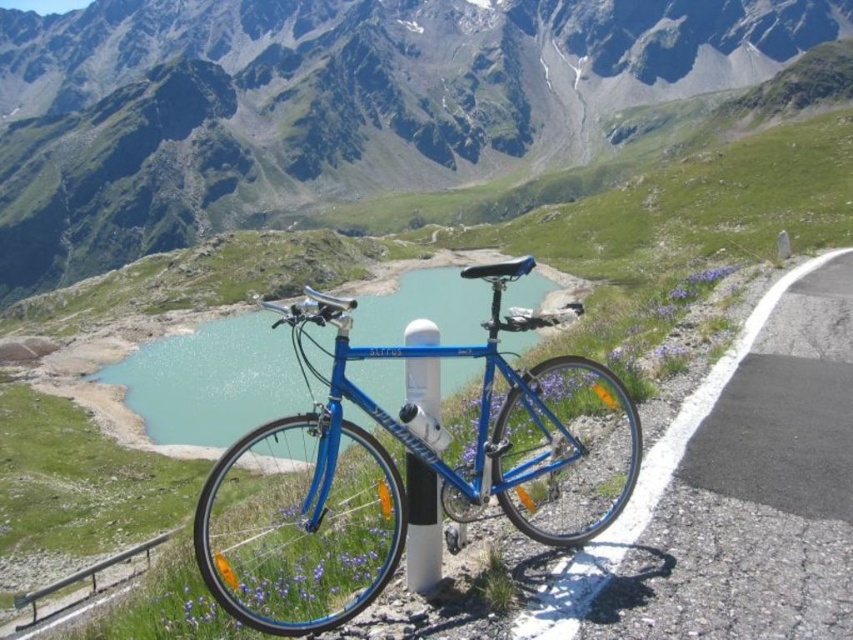
Measure the distance between point (x=195, y=160) and camera.

The distance of point (x=195, y=160) from camera is 195.21 meters.

Where is `matte blue bicycle at center`? The height and width of the screenshot is (640, 853). matte blue bicycle at center is located at coordinates (328, 104).

Between point (67, 252) and point (393, 300), which one is positioned in front?

Point (393, 300) is more forward.

At what (x,y) coordinates should I click in order to perform the action: click on matte blue bicycle at center. Please return your answer as a coordinate pair (x, y). The height and width of the screenshot is (640, 853). Looking at the image, I should click on (328, 104).

Which is more to the left, matte blue bicycle at center or wooden rail at lower left?

From the viewer's perspective, matte blue bicycle at center appears more on the left side.

Describe the element at coordinates (328, 104) in the screenshot. This screenshot has height=640, width=853. I see `matte blue bicycle at center` at that location.

Between point (444, 100) and point (35, 600), which one is positioned in front?

Point (35, 600)

What are the coordinates of `matte blue bicycle at center` in the screenshot? It's located at (328, 104).

Does blue glassy water at center appear over wooden rail at lower left?

Correct, blue glassy water at center is located above wooden rail at lower left.

Which is more to the right, blue glassy water at center or wooden rail at lower left?

Positioned to the right is blue glassy water at center.

The image size is (853, 640). Find the location of `blue glassy water at center`. blue glassy water at center is located at coordinates (212, 380).